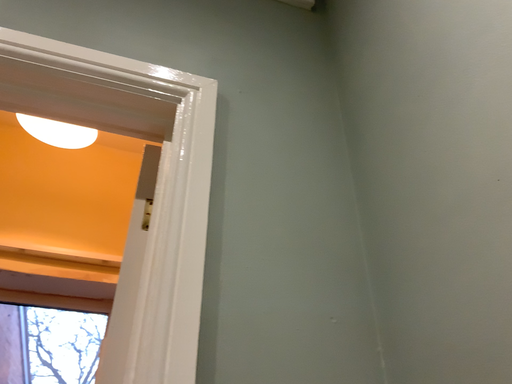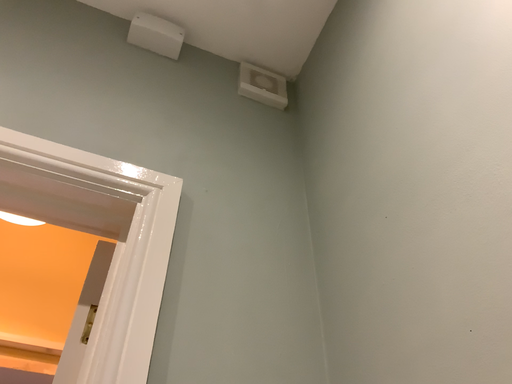
Question: Which way did the camera rotate in the video?

Choices:
 (A) rotated downward
 (B) rotated upward

Answer: (B)